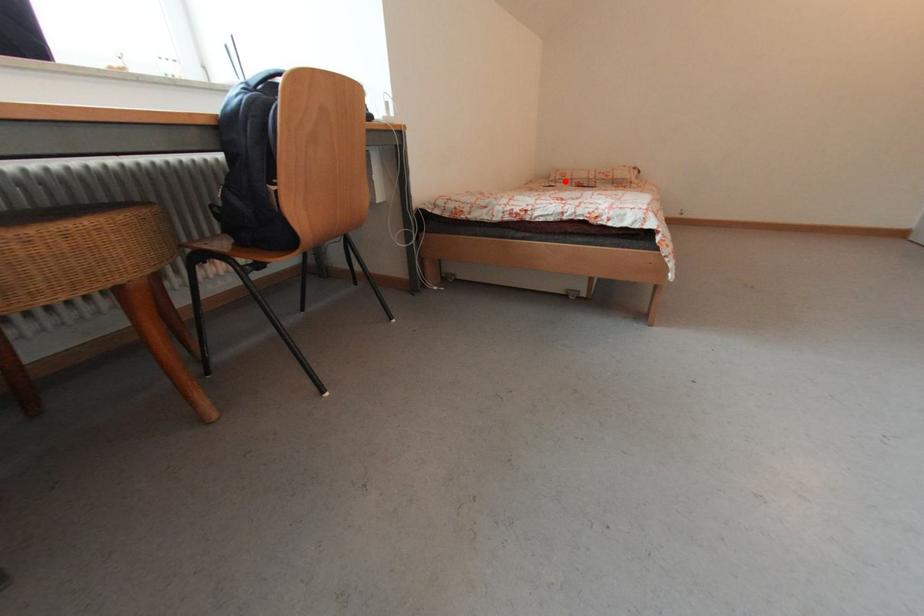
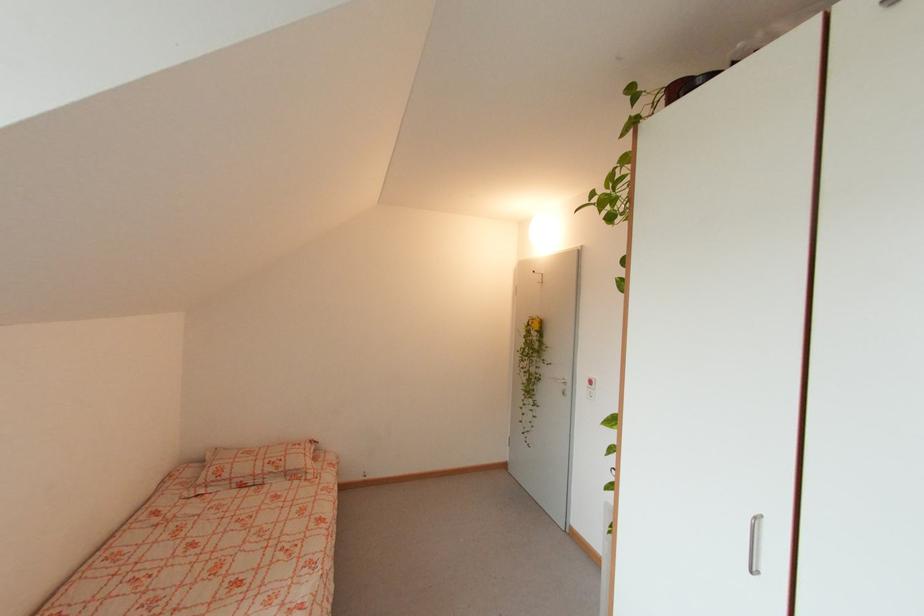
Question: A red point is marked in image1. In image2, is the corresponding 3D point closer to the camera or farther? Reply with the corresponding letter.

Choices:
 (A) The corresponding 3D point is closer.
 (B) The corresponding 3D point is farther.

Answer: (A)